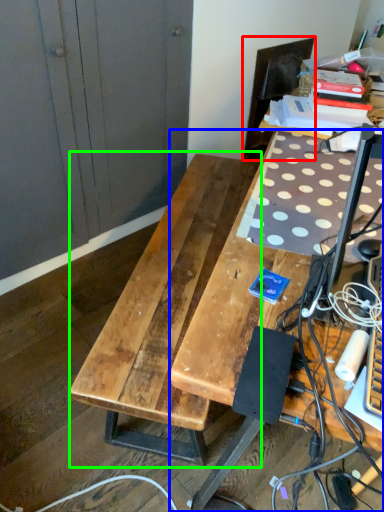
Question: Which object is the farthest from swivel chair (highlighted by a red box)? Choose among these: desk (highlighted by a blue box) or table (highlighted by a green box).

Choices:
 (A) desk
 (B) table

Answer: (A)